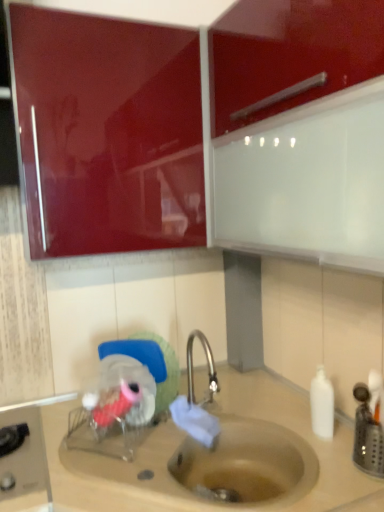
Question: Is glossy red cabinet at upper left at the left side of beige matte sink at lower center?

Choices:
 (A) no
 (B) yes

Answer: (B)

Question: Considering the relative sizes of glossy red cabinet at upper left and beige matte sink at lower center in the image provided, is glossy red cabinet at upper left smaller than beige matte sink at lower center?

Choices:
 (A) no
 (B) yes

Answer: (B)

Question: From a real-world perspective, is glossy red cabinet at upper left under beige matte sink at lower center?

Choices:
 (A) yes
 (B) no

Answer: (B)

Question: Is glossy red cabinet at upper left in front of beige matte sink at lower center?

Choices:
 (A) yes
 (B) no

Answer: (B)

Question: Does glossy red cabinet at upper left have a larger size compared to beige matte sink at lower center?

Choices:
 (A) no
 (B) yes

Answer: (A)

Question: From the image's perspective, is white matte bottle at right above or below beige matte sink at lower center?

Choices:
 (A) above
 (B) below

Answer: (A)

Question: Is white matte bottle at right spatially inside beige matte sink at lower center, or outside of it?

Choices:
 (A) inside
 (B) outside

Answer: (B)

Question: In terms of width, does white matte bottle at right look wider or thinner when compared to beige matte sink at lower center?

Choices:
 (A) thin
 (B) wide

Answer: (A)

Question: Would you say white matte bottle at right is to the left or to the right of beige matte sink at lower center in the picture?

Choices:
 (A) left
 (B) right

Answer: (B)

Question: Choose the correct answer: Is white matte bottle at right inside glossy red cabinet at upper left or outside it?

Choices:
 (A) inside
 (B) outside

Answer: (B)

Question: In terms of size, does white matte bottle at right appear bigger or smaller than glossy red cabinet at upper left?

Choices:
 (A) small
 (B) big

Answer: (A)

Question: In the image, is white matte bottle at right on the left side or the right side of glossy red cabinet at upper left?

Choices:
 (A) left
 (B) right

Answer: (B)

Question: In the image, is white matte bottle at right positioned in front of or behind glossy red cabinet at upper left?

Choices:
 (A) behind
 (B) front

Answer: (A)

Question: From a real-world perspective, is glossy red cabinet at upper left above or below white matte bottle at right?

Choices:
 (A) below
 (B) above

Answer: (B)

Question: In terms of width, does glossy red cabinet at upper left look wider or thinner when compared to white matte bottle at right?

Choices:
 (A) wide
 (B) thin

Answer: (A)